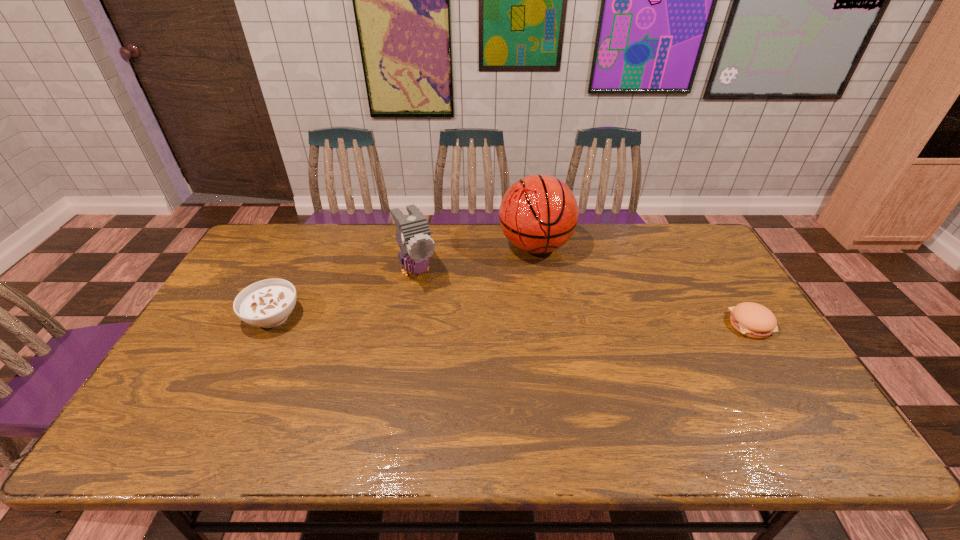
You are a GUI agent. You are given a task and a screenshot of the screen. Output one action in this format:
    pyautogui.click(x=<x>, y=<y>)
    Task: Click on the blank space located at the beak of the second object from left to right
    
    Given the screenshot: What is the action you would take?
    pyautogui.click(x=438, y=320)

Image resolution: width=960 pixels, height=540 pixels. Identify the location of free space located at the beak of the second object from left to right. (436, 315).

Find the location of a particular element. Image resolution: width=960 pixels, height=540 pixels. free space located at the beak of the second object from left to right is located at coordinates (445, 334).

Image resolution: width=960 pixels, height=540 pixels. What are the coordinates of `free space located on the side with spill of the basketball` in the screenshot? It's located at (544, 309).

The height and width of the screenshot is (540, 960). I want to click on vacant point located on the side with spill of the basketball, so click(542, 298).

Where is `free space located 0.230m on the side with spill of the basketball`? Image resolution: width=960 pixels, height=540 pixels. free space located 0.230m on the side with spill of the basketball is located at coordinates (545, 322).

Image resolution: width=960 pixels, height=540 pixels. In order to click on bird present at the far edge in this screenshot , I will do `click(413, 235)`.

Where is `basketball present at the far edge`? basketball present at the far edge is located at coordinates (538, 214).

Image resolution: width=960 pixels, height=540 pixels. Find the location of `object at the left edge`. object at the left edge is located at coordinates (268, 303).

Locate an element on the screen. This screenshot has width=960, height=540. object located in the right edge section of the desktop is located at coordinates (751, 319).